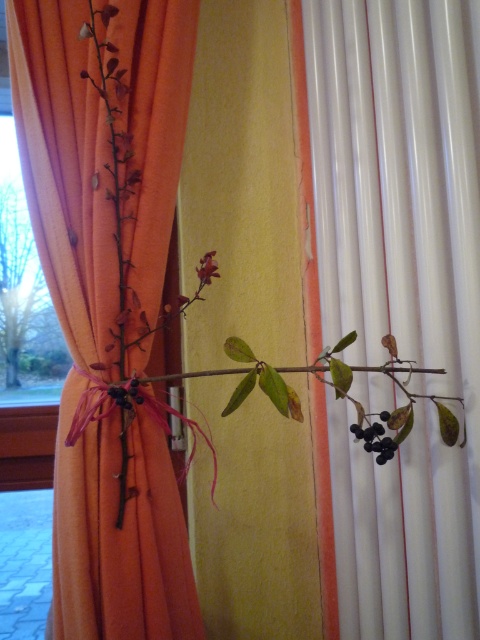
You are an interior designer looking to balance the visual weight of the green matte branch at center and the matte red flower at center in the scene. Given their sizes, which object should you place closer to the edge of the arrangement to maintain balance?

The green matte branch at center is bigger than the matte red flower at center. To balance their visual weights, the larger green matte branch at center should be placed closer to the edge of the arrangement, while the smaller matte red flower at center can be positioned nearer the center to maintain equilibrium.

You are arranging flowers in a vase and need to place the green matte branch at right and the matte red flower at center. Based on their positions in the image, which object should you place first to the left side of the vase?

The matte red flower at center should be placed first to the left side of the vase because the green matte branch at right is positioned to the right of it in the image.

You are hanging decorations for a party and see the green matte branch at right and the matte red flower at center. Which decoration is located below the other?

The green matte branch at right is positioned under the matte red flower at center.